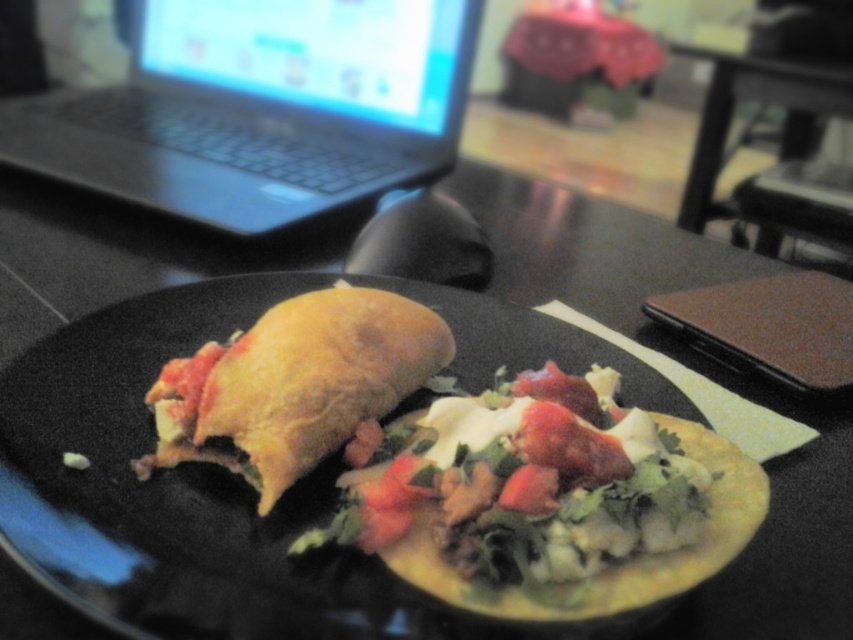
You are a student trying to reach for your golden brown tortilla at center while your black plastic laptop at upper left is in the way. Can you move your hand under the laptop to grab the tortilla?

The black plastic laptop at upper left is above the golden brown tortilla at center, so yes, you can move your hand under the laptop to reach the tortilla.

You are organizing a study session at your dining table. You have a black plastic laptop at upper left and a yellow tortilla at center on the table. Which object takes up more horizontal space on the table?

The black plastic laptop at upper left takes up more horizontal space on the table because its width is larger than the yellow tortilla at center.